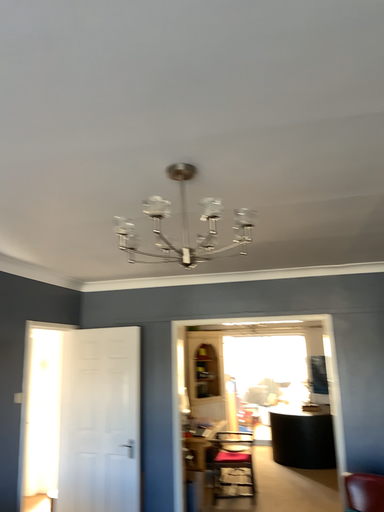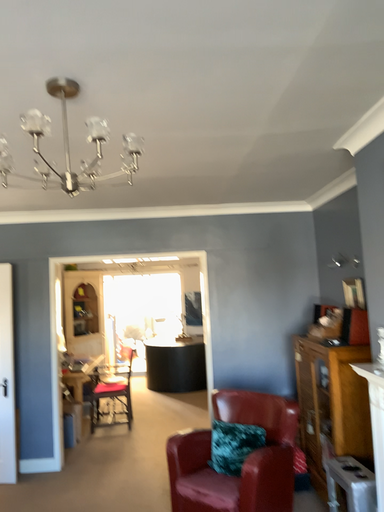
Question: Which way did the camera rotate in the video?

Choices:
 (A) rotated upward
 (B) rotated downward

Answer: (B)